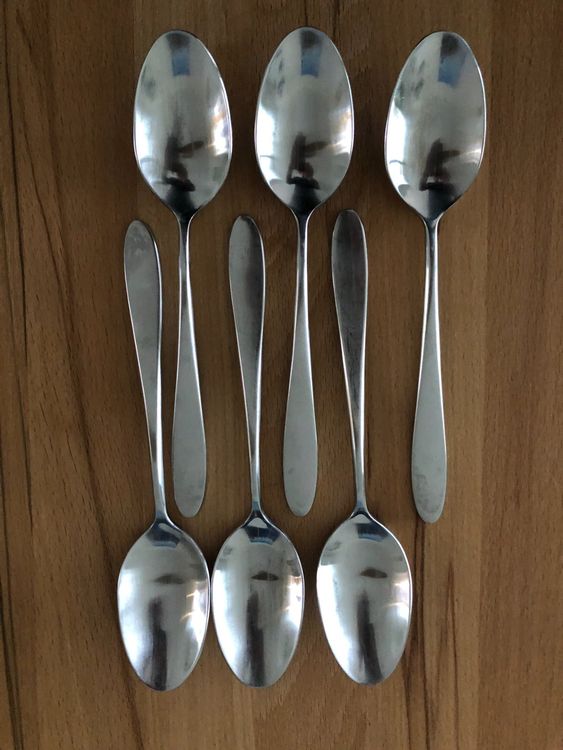
The image size is (563, 750). I want to click on spoon handles, so click(154, 327), click(183, 432), click(245, 313), click(310, 423), click(350, 325), click(428, 442).